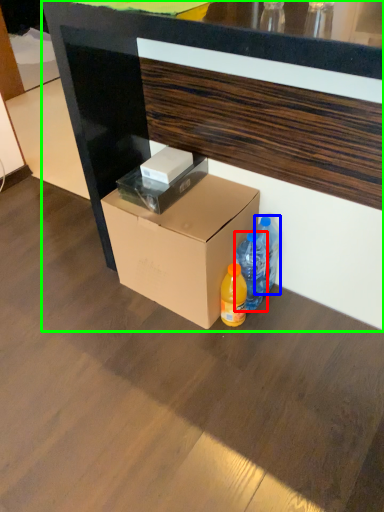
Question: Based on their relative distances, which object is farther from bottle (highlighted by a red box)? Choose from bottle (highlighted by a blue box) and desk (highlighted by a green box).

Choices:
 (A) bottle
 (B) desk

Answer: (B)